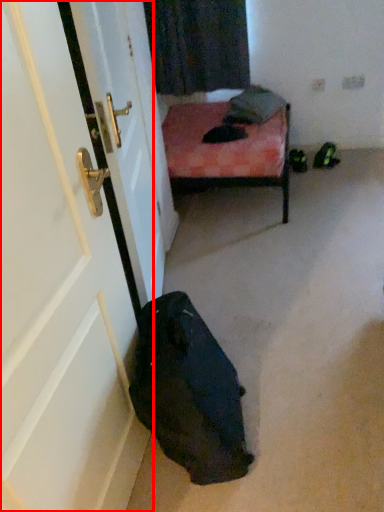
Question: From the image's perspective, where is door (annotated by the red box) located in relation to pillow in the image?

Choices:
 (A) below
 (B) above

Answer: (A)